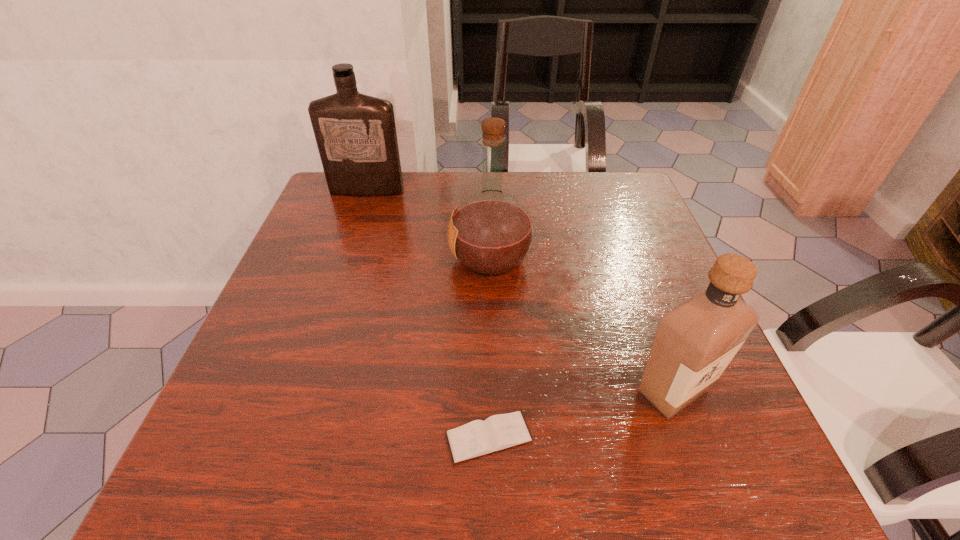
Find the location of a particular element. This screenshot has height=540, width=960. free space at the left edge is located at coordinates (256, 379).

This screenshot has height=540, width=960. I want to click on free space at the right edge of the desktop, so click(677, 429).

The width and height of the screenshot is (960, 540). What are the coordinates of `free spot at the far left corner of the desktop` in the screenshot? It's located at (368, 204).

The image size is (960, 540). What are the coordinates of `free space that is in between the farthest object and the second farthest object` in the screenshot? It's located at (429, 225).

The height and width of the screenshot is (540, 960). What are the coordinates of `unoccupied position between the diary and the rightmost object` in the screenshot? It's located at (581, 414).

Locate an element on the screen. This screenshot has height=540, width=960. free spot between the farthest liquor and the diary is located at coordinates (428, 314).

This screenshot has height=540, width=960. Find the location of `vacant space that's between the farthest object and the second farthest object`. vacant space that's between the farthest object and the second farthest object is located at coordinates (429, 225).

Find the location of a particular element. empty space between the diary and the third nearest object is located at coordinates (490, 348).

Where is `vacant space that's between the leftmost liquor and the nearest liquor`? This screenshot has width=960, height=540. vacant space that's between the leftmost liquor and the nearest liquor is located at coordinates (520, 291).

The image size is (960, 540). What are the coordinates of `vacant space that is in between the shortest object and the farthest liquor` in the screenshot? It's located at (428, 314).